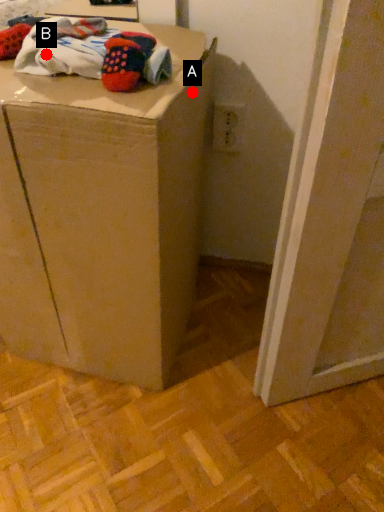
Question: Two points are circled on the image, labeled by A and B beside each circle. Which point is farther from the camera taking this photo?

Choices:
 (A) A is further
 (B) B is further

Answer: (A)